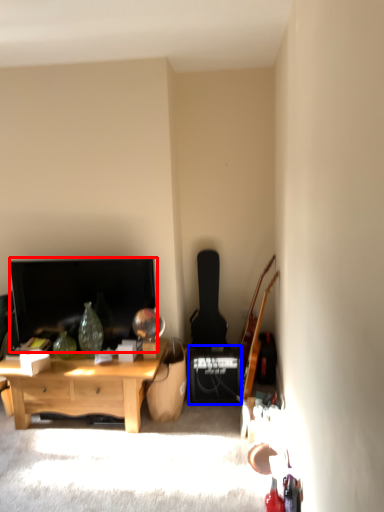
Question: Among these objects, which one is farthest to the camera, television (highlighted by a red box) or speaker (highlighted by a blue box)?

Choices:
 (A) television
 (B) speaker

Answer: (B)